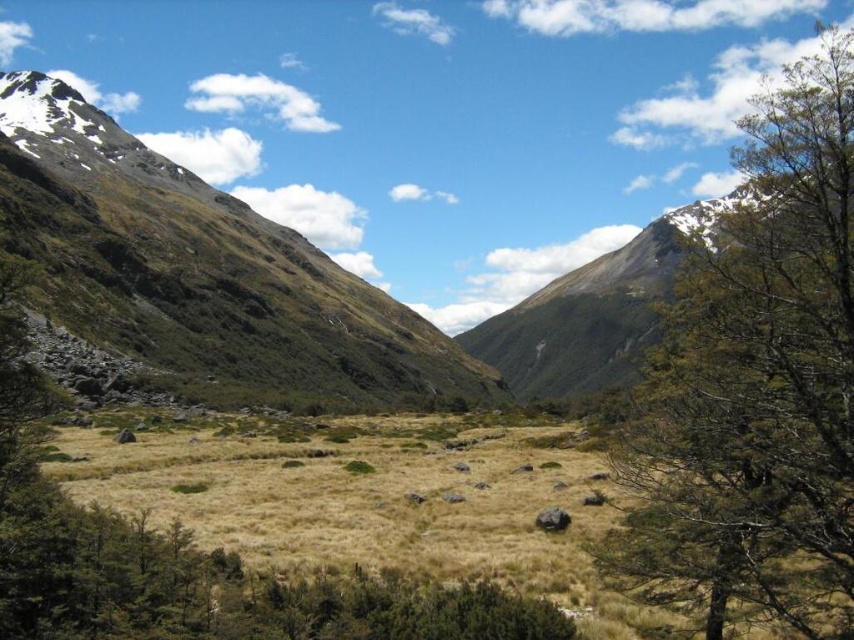
Question: Is green leafy tree at right smaller than green grassy mountain at center?

Choices:
 (A) yes
 (B) no

Answer: (B)

Question: Which point appears farthest from the camera in this image?

Choices:
 (A) (635, 246)
 (B) (753, 385)
 (C) (249, 244)

Answer: (A)

Question: Is brown rocky mountain at center smaller than green grassy mountain at center?

Choices:
 (A) yes
 (B) no

Answer: (A)

Question: Which object is farther from the camera taking this photo?

Choices:
 (A) green grassy mountain at center
 (B) green leafy tree at right

Answer: (A)

Question: Which point is closer to the camera?

Choices:
 (A) green leafy tree at right
 (B) green grassy mountain at center
 (C) brown rocky mountain at center

Answer: (A)

Question: Is brown rocky mountain at center in front of green grassy mountain at center?

Choices:
 (A) yes
 (B) no

Answer: (A)